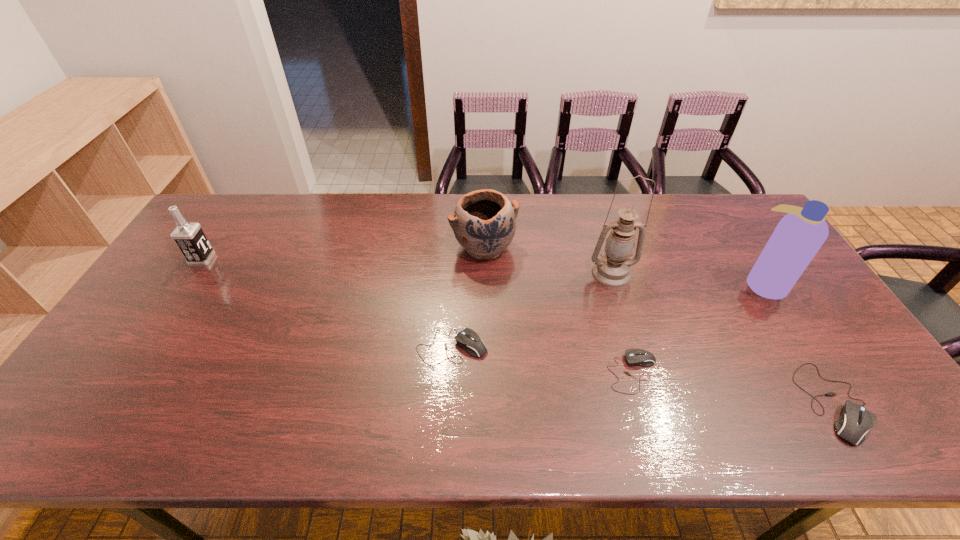
Find the location of `free point that satisfies the following two spatial constraints: 1. on the front side of the oil lamp; 2. on the left side of the pottery`. free point that satisfies the following two spatial constraints: 1. on the front side of the oil lamp; 2. on the left side of the pottery is located at coordinates (484, 274).